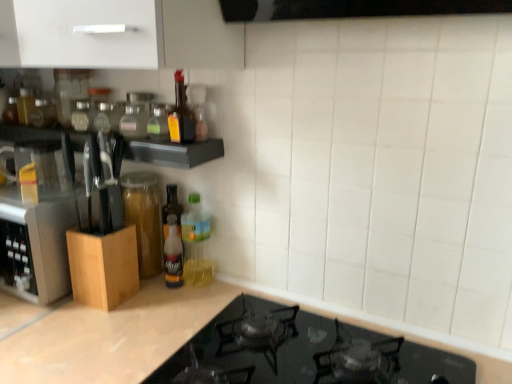
Question: Should I look upward or downward to see translucent glass bottle at upper center, the third bottle positioned from the bottom?

Choices:
 (A) down
 (B) up

Answer: (B)

Question: Does matte glass bottle at upper center, the 5th bottle ordered from the bottom, lie in front of translucent glass bottle at center, which is the sixth bottle in top-to-bottom order?

Choices:
 (A) yes
 (B) no

Answer: (A)

Question: Is matte glass bottle at upper center, the second bottle viewed from the top, to the left of translucent glass bottle at center, the first bottle positioned from the bottom, from the viewer's perspective?

Choices:
 (A) no
 (B) yes

Answer: (A)

Question: Does matte glass bottle at upper center, the second bottle viewed from the top, contain translucent glass bottle at center, the first bottle positioned from the bottom?

Choices:
 (A) yes
 (B) no

Answer: (B)

Question: Is matte glass bottle at upper center, the second bottle viewed from the top, oriented away from translucent glass bottle at center, the first bottle positioned from the bottom?

Choices:
 (A) yes
 (B) no

Answer: (B)

Question: Is matte glass bottle at upper center, the second bottle viewed from the top, directly adjacent to translucent glass bottle at center, the first bottle positioned from the bottom?

Choices:
 (A) yes
 (B) no

Answer: (B)

Question: Does matte glass bottle at upper center, the 5th bottle ordered from the bottom, have a greater width compared to translucent glass bottle at center, which is the sixth bottle in top-to-bottom order?

Choices:
 (A) no
 (B) yes

Answer: (B)

Question: Is translucent plastic bottle at upper center, the 4th bottle ordered from the bottom, positioned beyond the bounds of clear glass bottle at upper center, the first bottle from the top?

Choices:
 (A) no
 (B) yes

Answer: (B)

Question: From the image's perspective, would you say translucent plastic bottle at upper center, the third bottle when ordered from top to bottom, is shown under clear glass bottle at upper center, the first bottle from the top?

Choices:
 (A) no
 (B) yes

Answer: (B)

Question: Would you consider translucent plastic bottle at upper center, the third bottle when ordered from top to bottom, to be distant from clear glass bottle at upper center, which is the 6th bottle from bottom to top?

Choices:
 (A) no
 (B) yes

Answer: (A)

Question: Is translucent plastic bottle at upper center, the 4th bottle ordered from the bottom, next to clear glass bottle at upper center, the first bottle from the top?

Choices:
 (A) no
 (B) yes

Answer: (A)

Question: Is translucent plastic bottle at upper center, the third bottle when ordered from top to bottom, shorter than clear glass bottle at upper center, which is the 6th bottle from bottom to top?

Choices:
 (A) no
 (B) yes

Answer: (A)

Question: Considering the relative positions of translucent plastic bottle at upper center, the third bottle when ordered from top to bottom, and clear glass bottle at upper center, which is the 6th bottle from bottom to top, in the image provided, is translucent plastic bottle at upper center, the third bottle when ordered from top to bottom, to the right of clear glass bottle at upper center, which is the 6th bottle from bottom to top, from the viewer's perspective?

Choices:
 (A) no
 (B) yes

Answer: (B)

Question: From a real-world perspective, is black glass stovetop at lower center beneath transparent glass jar at left?

Choices:
 (A) yes
 (B) no

Answer: (A)